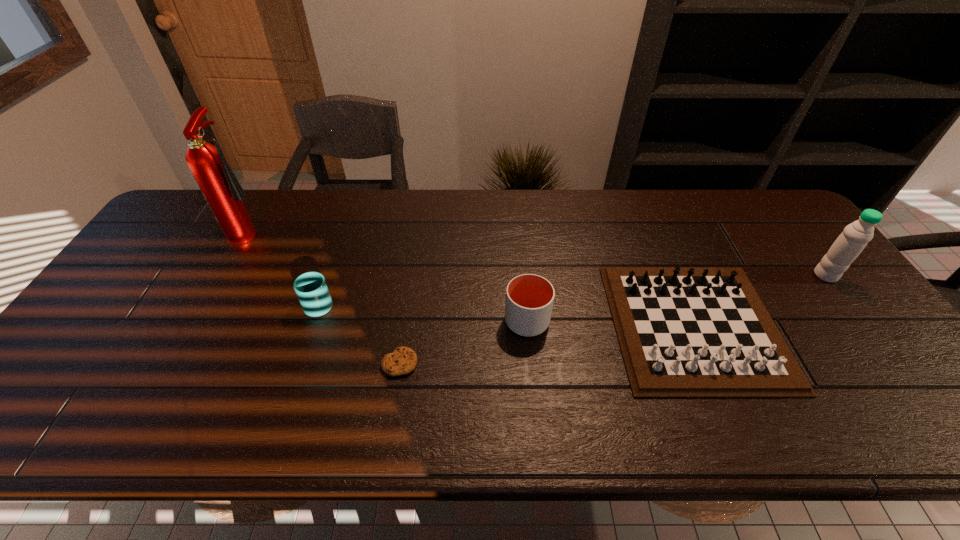
Find the location of a particular element. The image size is (960, 540). vacant space that satisfies the following two spatial constraints: 1. at the nozzle of the leftmost object; 2. on the back side of the cookie is located at coordinates (177, 363).

This screenshot has width=960, height=540. Identify the location of vacant space that satisfies the following two spatial constraints: 1. at the nozzle of the farthest object; 2. on the left side of the fifth object from left to right. (198, 326).